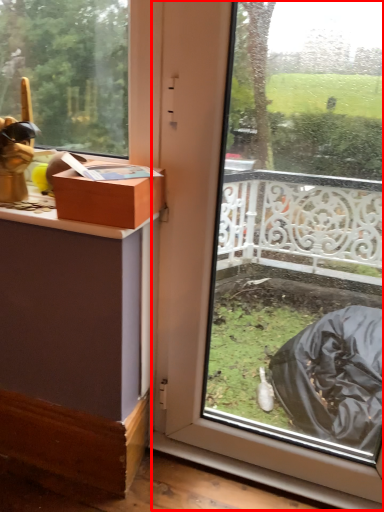
Question: In this image, where is glass door (annotated by the red box) located relative to box?

Choices:
 (A) right
 (B) left

Answer: (A)